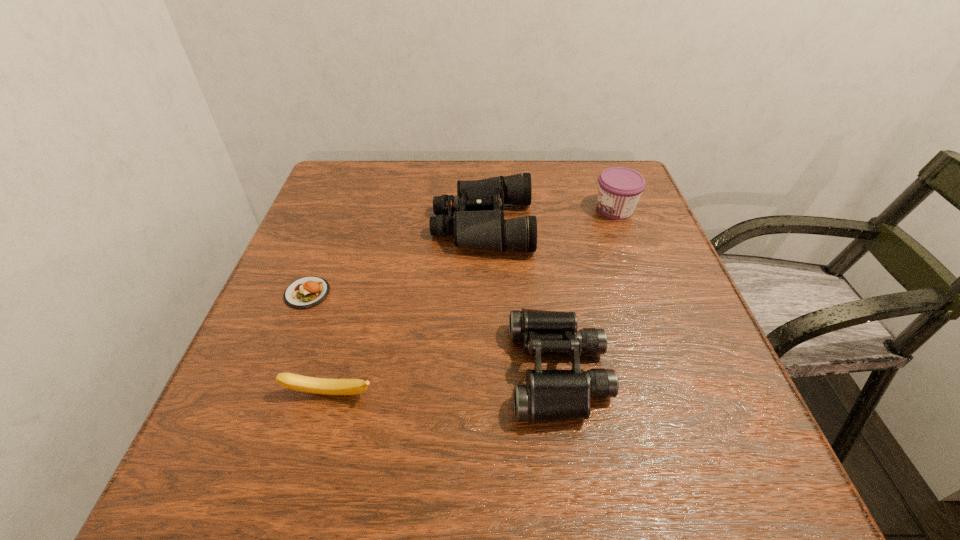
The width and height of the screenshot is (960, 540). In order to click on patty (food) located in the left edge section of the desktop in this screenshot , I will do `click(306, 292)`.

The image size is (960, 540). I want to click on object at the right edge, so click(x=619, y=190).

Identify the location of object at the far right corner. The image size is (960, 540). (619, 190).

You are a GUI agent. You are given a task and a screenshot of the screen. Output one action in this format:
    pyautogui.click(x=<x>, y=<y>)
    Task: Click on the vacant area at the far edge of the desktop
    
    Given the screenshot: What is the action you would take?
    pyautogui.click(x=511, y=163)

The image size is (960, 540). In order to click on blank space at the near edge of the desktop in this screenshot , I will do `click(626, 489)`.

Find the location of a particular element. The width and height of the screenshot is (960, 540). vacant space at the left edge is located at coordinates (331, 238).

The height and width of the screenshot is (540, 960). In the image, there is a desktop. Find the location of `vacant space at the right edge`. vacant space at the right edge is located at coordinates (700, 332).

Where is `vacant space at the far right corner of the desktop`? vacant space at the far right corner of the desktop is located at coordinates coord(612,159).

Identify the location of free space between the farther binoculars and the third nearest object. The width and height of the screenshot is (960, 540). (396, 259).

Find the location of a particular element. vacant area that lies between the jam and the farther binoculars is located at coordinates (549, 217).